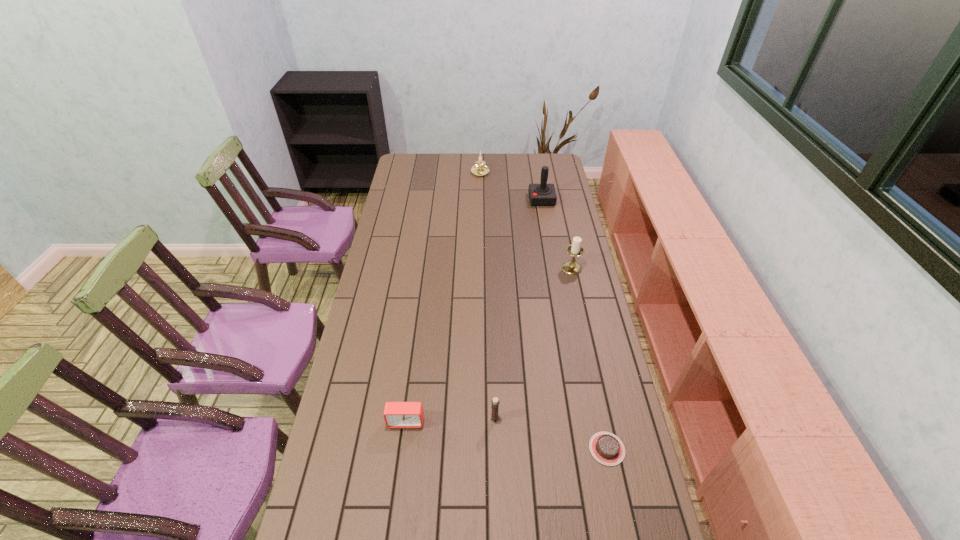
Identify the location of blank region between the nearest candle holder and the joystick. Image resolution: width=960 pixels, height=540 pixels. (518, 309).

Locate an element on the screen. vacant space that is in between the farthest object and the fifth nearest object is located at coordinates (511, 186).

You are a GUI agent. You are given a task and a screenshot of the screen. Output one action in this format:
    pyautogui.click(x=<x>, y=<y>)
    Task: Click on the free space between the alarm clock and the joystick
    
    Given the screenshot: What is the action you would take?
    pyautogui.click(x=474, y=310)

The image size is (960, 540). Find the location of `vacant space that is in between the alarm clock and the shortest object`. vacant space that is in between the alarm clock and the shortest object is located at coordinates (507, 435).

Identify which object is located as the second nearest to the nearest object. Please provide its 2D coordinates. Your answer should be formatted as a tuple, i.e. [(x, y)], where the tuple contains the x and y coordinates of a point satisfying the conditions above.

[(396, 414)]

Where is `object that can be found as the fourth closest to the farthest object`? The width and height of the screenshot is (960, 540). object that can be found as the fourth closest to the farthest object is located at coordinates (396, 414).

Locate an element on the screen. candle holder that is the second closest to the tallest candle holder is located at coordinates 480,169.

Where is `candle holder that stands as the third closest to the chocolate cake`? candle holder that stands as the third closest to the chocolate cake is located at coordinates (480, 169).

You are a GUI agent. You are given a task and a screenshot of the screen. Output one action in this format:
    pyautogui.click(x=<x>, y=<y>)
    Task: Click on the vacant space that satisfies the following two spatial constraints: 1. on the handle side of the nearest candle holder; 2. on the left side of the farthest object
    The width and height of the screenshot is (960, 540).
    Given the screenshot: What is the action you would take?
    pyautogui.click(x=481, y=418)

Find the location of a particular element. vacant area that satisfies the following two spatial constraints: 1. on the base of the fifth nearest object; 2. on the front-facing side of the fifth tallest object is located at coordinates pos(581,421).